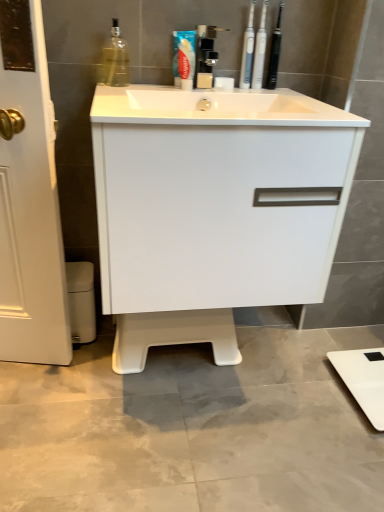
Locate an element on the screen. The width and height of the screenshot is (384, 512). vacant area that is in front of satin nickel faucet at upper center is located at coordinates (211, 100).